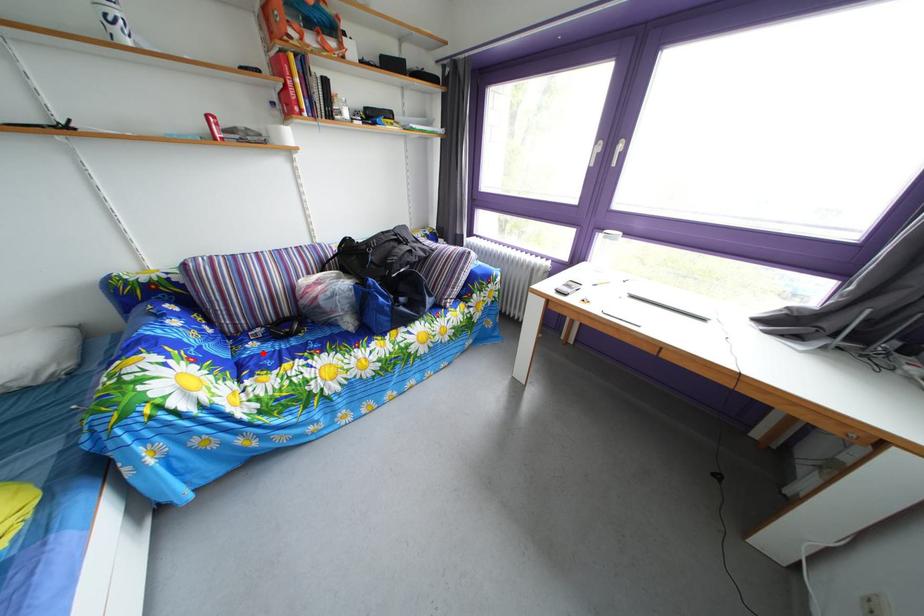
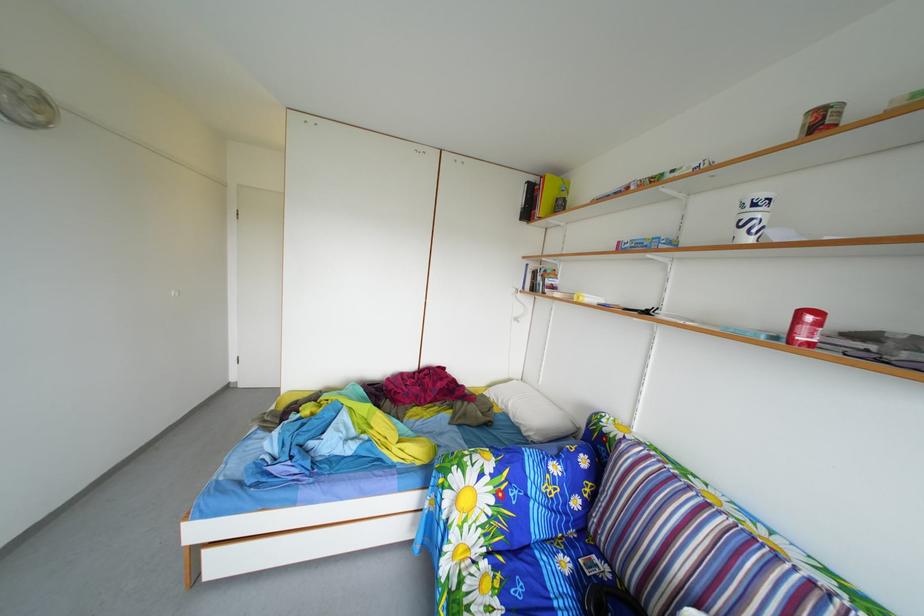
The point at the highlighted location is marked in the first image. Where is the corresponding point in the second image?

(576, 570)